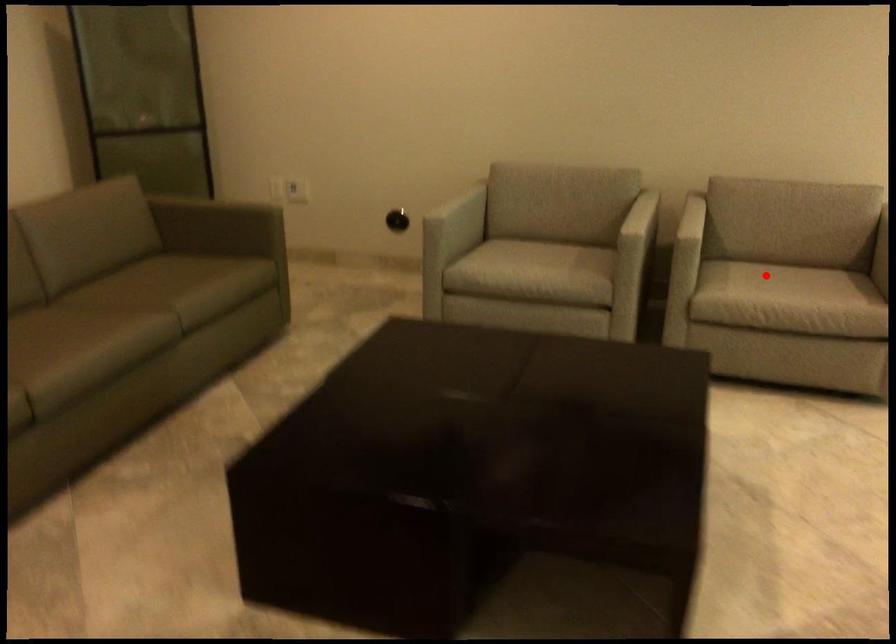
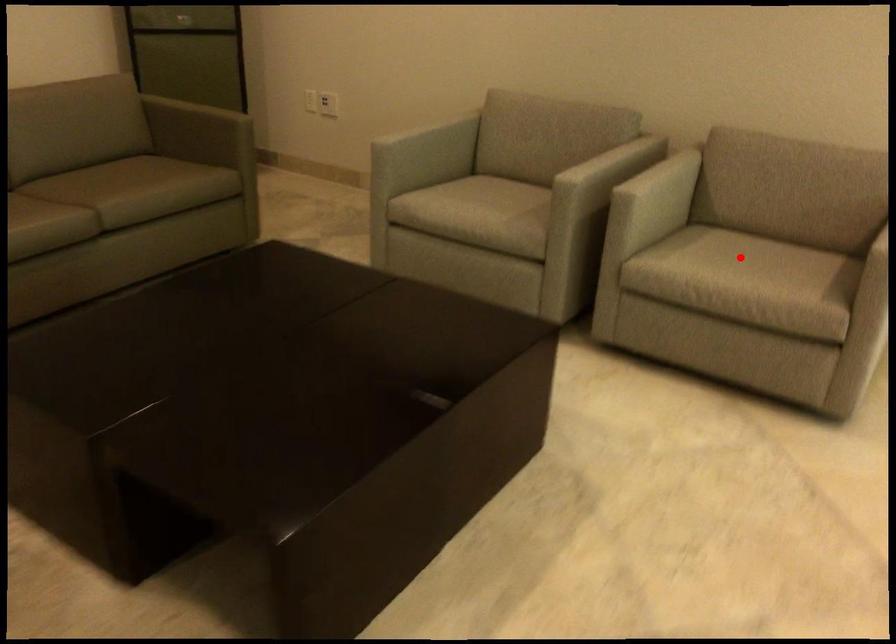
I am providing you with two images of the same scene from different viewpoints. A red point is marked on the first image and another point is marked on the second image. Do the highlighted points in image1 and image2 indicate the same real-world spot?

Yes